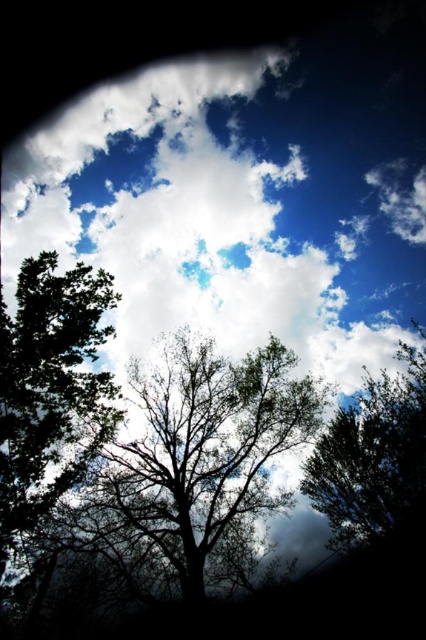
Question: Is silhouette leafy tree at center wider than green leafy tree at center?

Choices:
 (A) yes
 (B) no

Answer: (A)

Question: Which of the following is the farthest from the observer?

Choices:
 (A) green leafy tree at center
 (B) dark green leafy tree at left
 (C) silhouette leafy tree at center

Answer: (A)

Question: Is dark green leafy tree at left bigger than green leafy tree at center?

Choices:
 (A) no
 (B) yes

Answer: (A)

Question: Is silhouette leafy tree at center to the left of green leafy tree at center from the viewer's perspective?

Choices:
 (A) yes
 (B) no

Answer: (A)

Question: Based on their relative distances, which object is farther from the green leafy tree at center?

Choices:
 (A) silhouette leafy tree at center
 (B) dark green leafy tree at left

Answer: (B)

Question: Among these points, which one is nearest to the camera?

Choices:
 (A) (382, 445)
 (B) (157, 518)

Answer: (B)